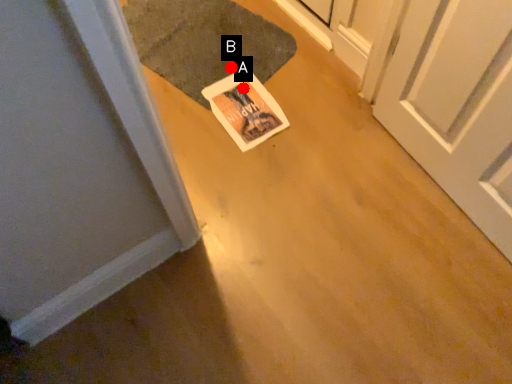
Question: Two points are circled on the image, labeled by A and B beside each circle. Which of the following is the closest to the observer?

Choices:
 (A) A is closer
 (B) B is closer

Answer: (A)